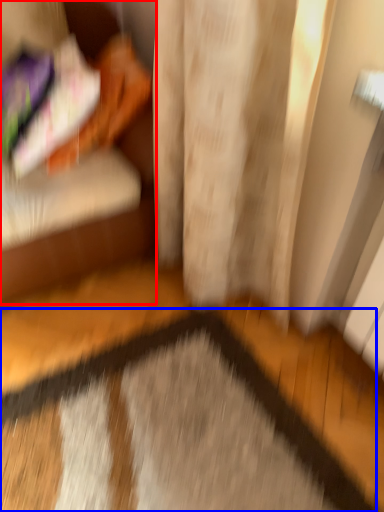
Question: Which object appears farthest to the camera in this image, furniture (highlighted by a red box) or doormat (highlighted by a blue box)?

Choices:
 (A) furniture
 (B) doormat

Answer: (A)